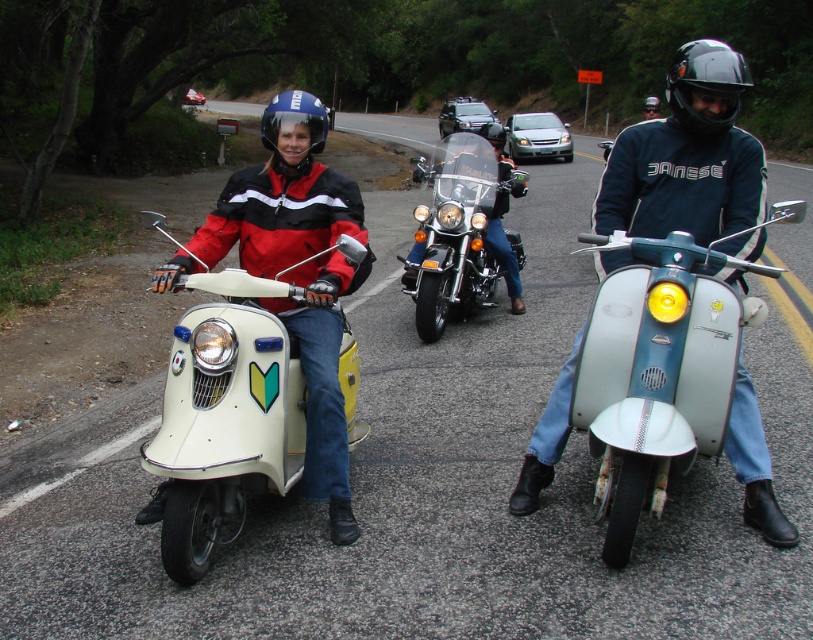
You are a photographer standing at the origin of the coordinate system. You want to take a photo of the white glossy scooter at center located at point (225, 416). Which direction should you move to get closer to it?

The white glossy scooter at center is located at point (225, 416). Since the photographer is at the origin, moving towards the positive x and y directions would bring them closer to the scooter.

You are a photographer trying to capture a clear shot of both the black matte helmet at upper center and the black matte goggles at upper center in the scene. Since you want to ensure both are visible, which object should you focus on first considering their sizes?

The black matte helmet at upper center has a greater width than the black matte goggles at upper center, so you should focus on the black matte helmet at upper center first to ensure it fits within the frame.